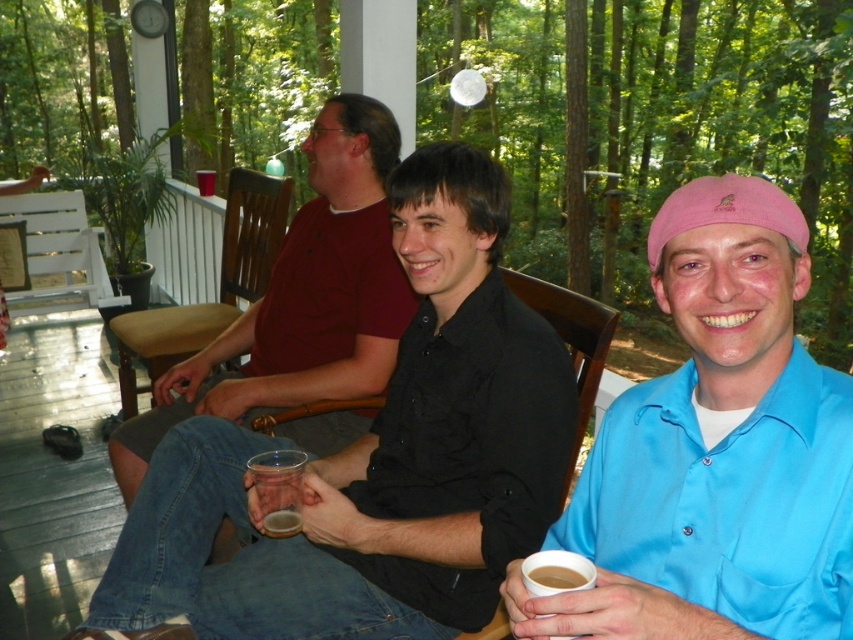
You are standing on the porch and want to reach the point marked at coordinates (637, 502). If your arm can extend 36 inches, can you comfortably reach that point without moving your feet?

The point marked at coordinates (637, 502) is 37.35 inches away from the viewer. Since your arm can only extend 36 inches, you cannot comfortably reach that point without moving your feet.

You are taking a photo of the two points in the image. Which point, point (714, 456) or point (294, 504), is closer to the camera?

Point (714, 456) is closer to the camera than point (294, 504).

You are a photographer trying to capture a closeup shot of the translucent plastic cup at center without including the pink fabric cap at upper right in the frame. Given their sizes, is this possible?

The pink fabric cap at upper right is larger than the translucent plastic cup at center, so it might be challenging to exclude the cap from the frame if they are positioned in a way that the cap overlaps or is near the cup. However, adjusting the camera angle or zoom could help focus solely on the cup.